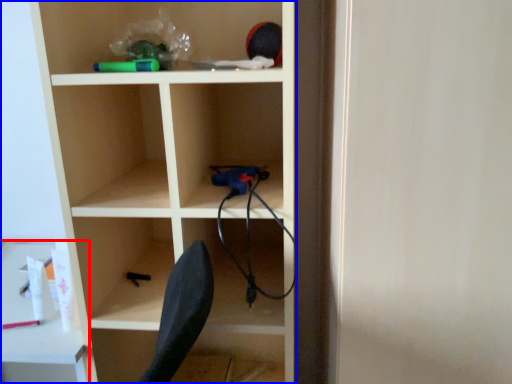
Question: Which object appears closest to the camera in this image, table (highlighted by a red box) or shelf (highlighted by a blue box)?

Choices:
 (A) table
 (B) shelf

Answer: (B)